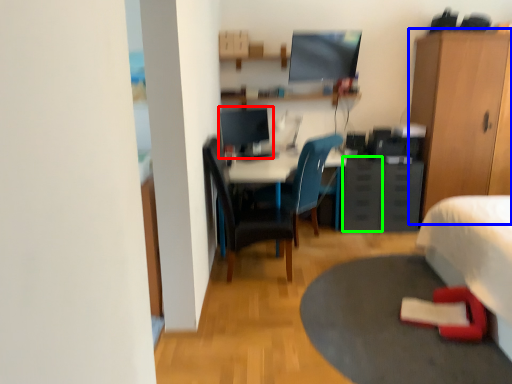
Question: Which object is positioned farthest from computer monitor (highlighted by a red box)? Select from cabinetry (highlighted by a blue box) and drawer (highlighted by a green box).

Choices:
 (A) cabinetry
 (B) drawer

Answer: (A)